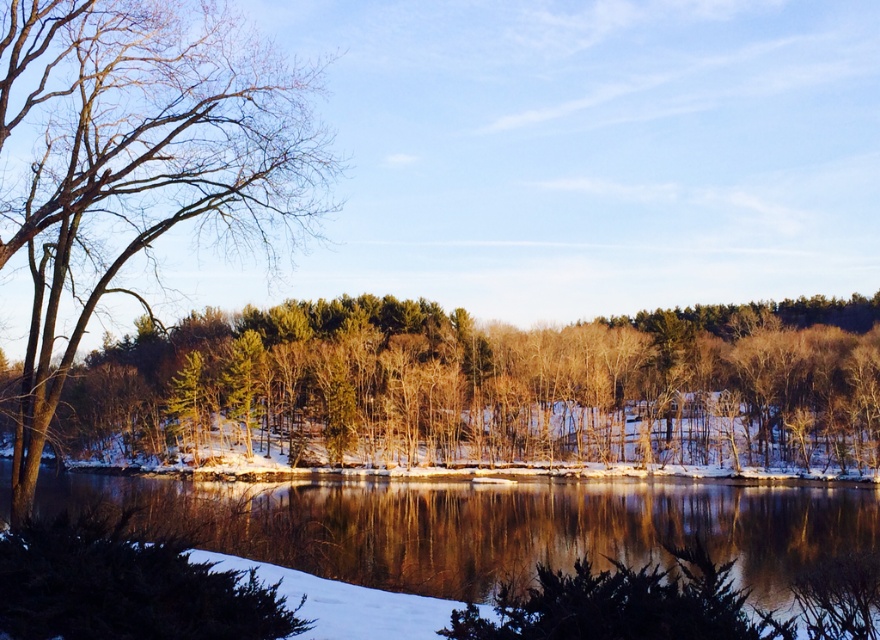
Is point (610, 420) closer to camera compared to point (123, 500)?

No, (610, 420) is further to viewer.

Locate an element on the screen. This screenshot has width=880, height=640. green matte tree at center is located at coordinates (484, 388).

Locate an element on the screen. The height and width of the screenshot is (640, 880). green matte tree at center is located at coordinates (484, 388).

Between green matte tree at center and bare branches at left, which one has less height?

bare branches at left

Identify the location of green matte tree at center. (484, 388).

Where is `green matte tree at center`? The width and height of the screenshot is (880, 640). green matte tree at center is located at coordinates (484, 388).

Between bare branches at left and glossy reflective water at center, which one has less height?

glossy reflective water at center

Does bare branches at left have a greater height compared to glossy reflective water at center?

Yes.

Does point (70, 26) lie in front of point (478, 595)?

No, (70, 26) is further to viewer.

Identify the location of bare branches at left. The image size is (880, 640). (137, 161).